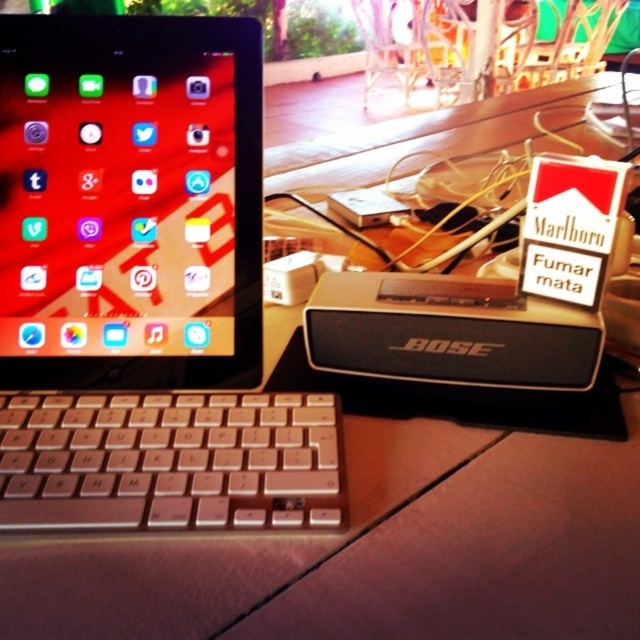
You are organizing your desk and want to place a new mouse between the silver metallic laptop at left and the silver metallic keyboard at lower left. Based on their positions, where should you place the mouse?

The silver metallic laptop at left is located above the silver metallic keyboard at lower left, so you should place the mouse between them in the space below the laptop and above the keyboard.

You are organizing your desk and want to place both the silver metallic laptop at left and the silver metallic keyboard at lower left into a storage box. The box can only accommodate one large item or two small items. Based on their sizes, which item should you prioritize placing first?

The silver metallic laptop at left is larger in size than the silver metallic keyboard at lower left, so you should prioritize placing the silver metallic laptop at left first into the storage box to ensure it fits before the smaller keyboard.